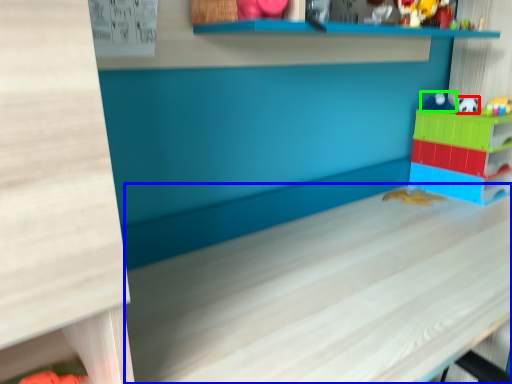
Question: Based on their relative distances, which object is nearer to toy (highlighted by a red box)? Choose from table (highlighted by a blue box) and toy (highlighted by a green box).

Choices:
 (A) table
 (B) toy

Answer: (B)